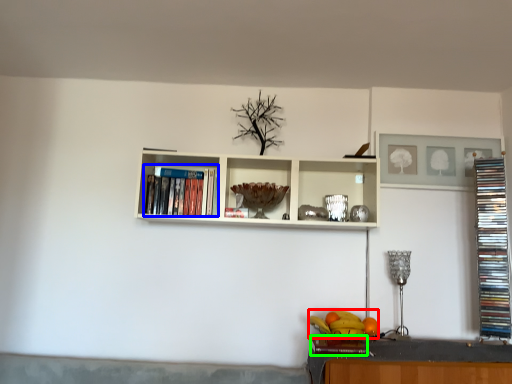
Question: Which is nearer to the fruit (highlighted by a red box)? book (highlighted by a blue box) or book (highlighted by a green box).

Choices:
 (A) book
 (B) book

Answer: (B)